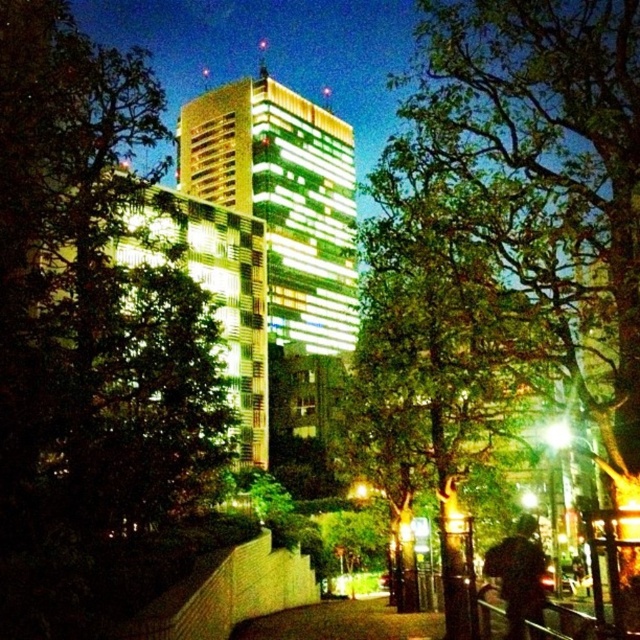
You are standing in the urban scene and want to take a photo of both the point at coordinates point (163, 296) and the point at coordinates point (237, 632). Which point should you focus on first to ensure both are in focus?

You should focus on point (163, 296) first because it is closer to the camera than point (237, 632). This ensures that both points will be within the depth of field when focusing on the closer one.